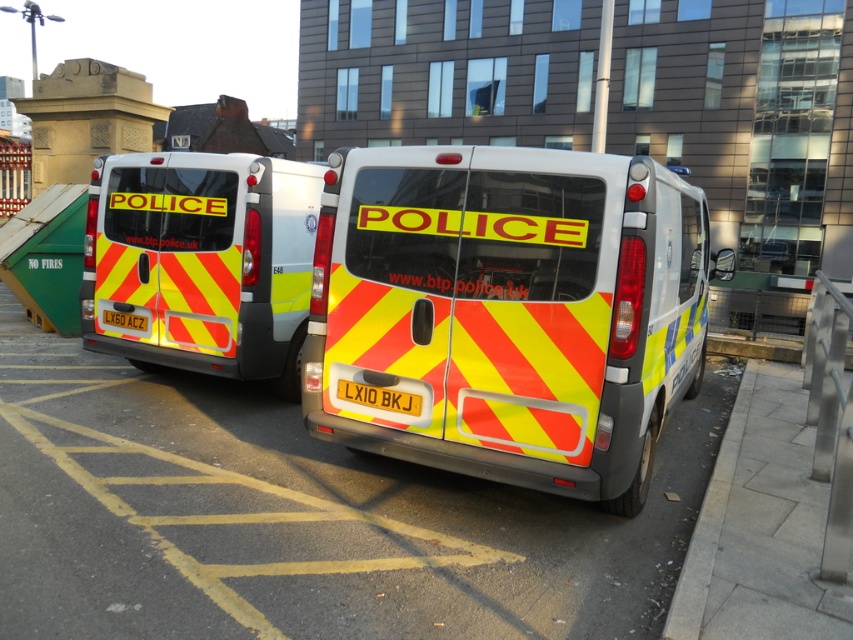
From the picture: Does yellow reflective van at center have a lesser height compared to yellow reflective material police van at center?

In fact, yellow reflective van at center may be taller than yellow reflective material police van at center.

Who is positioned more to the right, yellow reflective van at center or yellow reflective material police van at center?

From the viewer's perspective, yellow reflective van at center appears more on the right side.

Does point (646, 323) lie behind point (189, 176)?

No, it is not.

Where is `yellow reflective van at center`? Image resolution: width=853 pixels, height=640 pixels. yellow reflective van at center is located at coordinates (509, 312).

Is yellow reflective van at center smaller than yellow reflective plate at rear center?

Incorrect, yellow reflective van at center is not smaller in size than yellow reflective plate at rear center.

At what (x,y) coordinates should I click in order to perform the action: click on yellow reflective van at center. Please return your answer as a coordinate pair (x, y). This screenshot has width=853, height=640. Looking at the image, I should click on (509, 312).

In the scene shown: How far apart are yellow reflective van at center and yellow reflective plate at center?

The distance of yellow reflective van at center from yellow reflective plate at center is 1.61 meters.

Is yellow reflective van at center positioned behind yellow reflective plate at center?

That is False.

Where is `yellow reflective van at center`? yellow reflective van at center is located at coordinates (509, 312).